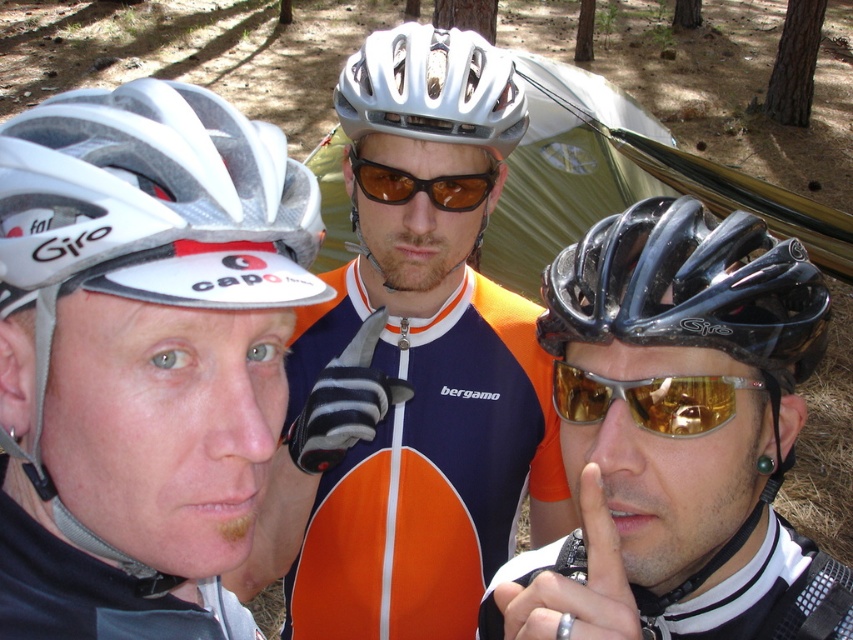
Question: Which object is the farthest from the black glossy helmet at center?

Choices:
 (A) black glossy bicycle helmet at center
 (B) white matte bicycle helmet at left
 (C) metallic ring at center
 (D) brown reflective sunglasses at center

Answer: (D)

Question: Is white matte bicycle helmet at left positioned before black glossy bicycle helmet at center?

Choices:
 (A) no
 (B) yes

Answer: (B)

Question: Which point is closer to the camera?

Choices:
 (A) (672, 404)
 (B) (605, 337)

Answer: (A)

Question: Which point is closer to the camera?

Choices:
 (A) metallic ring at center
 (B) black glossy helmet at center

Answer: (A)

Question: Does white matte bicycle helmet at left have a larger size compared to black glossy helmet at center?

Choices:
 (A) no
 (B) yes

Answer: (B)

Question: Does matte white helmet at center appear over white matte bicycle helmet at center?

Choices:
 (A) no
 (B) yes

Answer: (A)